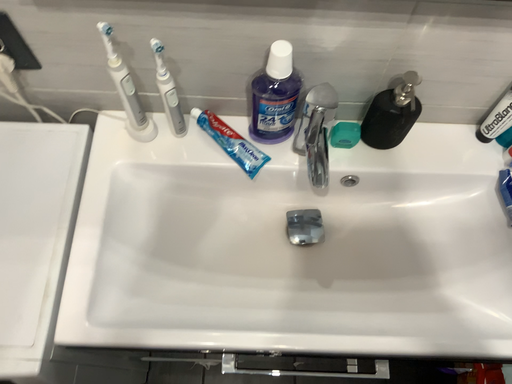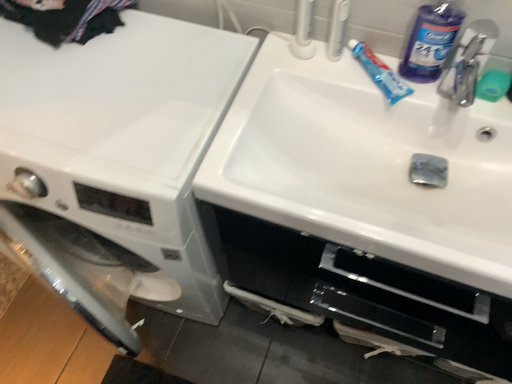
Question: How did the camera likely rotate when shooting the video?

Choices:
 (A) rotated upward
 (B) rotated downward

Answer: (A)